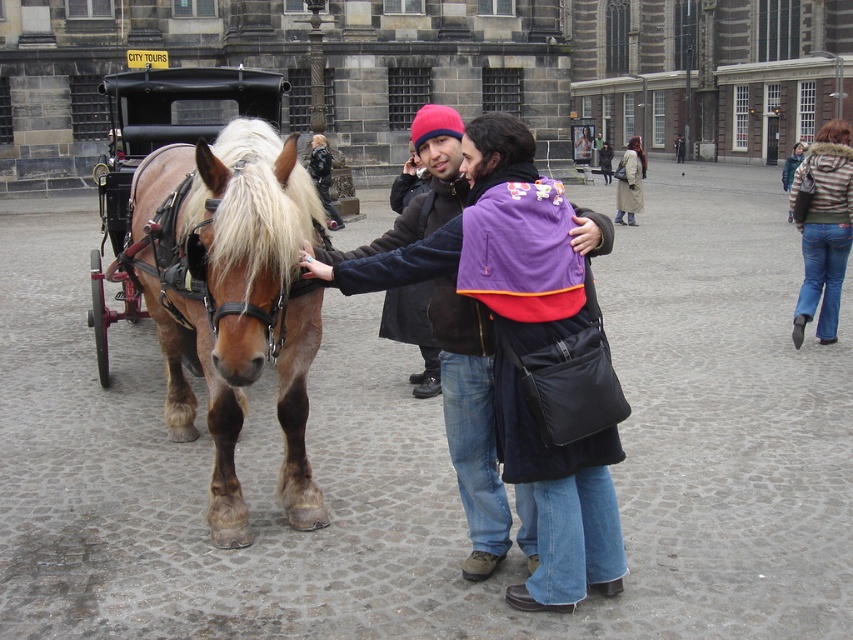
Question: Is brown glossy horse at left further to camera compared to light brown leather coat at center?

Choices:
 (A) no
 (B) yes

Answer: (A)

Question: Is brown glossy horse at left above polished wood cart at left?

Choices:
 (A) no
 (B) yes

Answer: (A)

Question: Can you confirm if brown glossy horse at left is positioned below striped fleece jacket at right?

Choices:
 (A) yes
 (B) no

Answer: (A)

Question: Among these objects, which one is farthest from the camera?

Choices:
 (A) matte black coat at center
 (B) brown glossy horse at left

Answer: (A)

Question: Among these objects, which one is farthest from the camera?

Choices:
 (A) brown glossy horse at left
 (B) striped fleece jacket at right

Answer: (B)

Question: Which of these objects is positioned farthest from the light brown leather coat at center?

Choices:
 (A) matte black coat at center
 (B) striped fleece jacket at right
 (C) polished wood cart at left
 (D) brown glossy horse at left

Answer: (A)